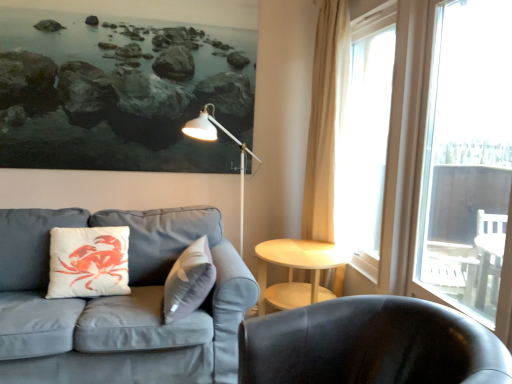
Describe the element at coordinates (88, 262) in the screenshot. The image size is (512, 384). I see `white matte pillow at left` at that location.

The height and width of the screenshot is (384, 512). Describe the element at coordinates (215, 140) in the screenshot. I see `white metal table lamp at upper center` at that location.

The width and height of the screenshot is (512, 384). Describe the element at coordinates (450, 161) in the screenshot. I see `transparent glass window at right, the second window in the back-to-front sequence` at that location.

Image resolution: width=512 pixels, height=384 pixels. Find the location of `transparent glass window at right, the second window in the back-to-front sequence`. transparent glass window at right, the second window in the back-to-front sequence is located at coordinates (450, 161).

Measure the distance between shiny black chair at lower right and camera.

The depth of shiny black chair at lower right is 1.15 meters.

What do you see at coordinates (298, 268) in the screenshot? I see `light wood/woodenobject at center` at bounding box center [298, 268].

At what (x,y) coordinates should I click in order to perform the action: click on white matte pillow at left. Please return your answer as a coordinate pair (x, y). The width and height of the screenshot is (512, 384). Looking at the image, I should click on (88, 262).

Is beige fabric curtain at right oriented towards white metal table lamp at upper center?

Yes, beige fabric curtain at right is aimed at white metal table lamp at upper center.

Between beige fabric curtain at right and white metal table lamp at upper center, which one has larger width?

white metal table lamp at upper center.

In order to click on table lamp that appears in front of the beige fabric curtain at right in this screenshot , I will do (x=215, y=140).

Can you confirm if gray fabric couch at left is bigger than transparent glass window at right, the first window positioned from the front?

Yes.

Considering the positions of point (2, 329) and point (451, 151), is point (2, 329) closer or farther from the camera than point (451, 151)?

Point (2, 329).

Which is correct: gray fabric couch at left is inside transparent glass window at right, the first window positioned from the front, or outside of it?

gray fabric couch at left exists outside the volume of transparent glass window at right, the first window positioned from the front.

Considering the sizes of transparent glass window at right, the second window in the back-to-front sequence, and white metal table lamp at upper center in the image, is transparent glass window at right, the second window in the back-to-front sequence, taller or shorter than white metal table lamp at upper center?

In the image, transparent glass window at right, the second window in the back-to-front sequence, appears to be taller than white metal table lamp at upper center.

Could white metal table lamp at upper center be considered to be inside transparent glass window at right, the second window in the back-to-front sequence?

No.

Can you tell me how much transparent glass window at right, the first window positioned from the front, and white metal table lamp at upper center differ in facing direction?

The angle between the facing direction of transparent glass window at right, the first window positioned from the front, and the facing direction of white metal table lamp at upper center is 43.1 degrees.

Which of these two, transparent glass window at right, the second window in the back-to-front sequence, or white metal table lamp at upper center, is wider?

With larger width is white metal table lamp at upper center.

This screenshot has width=512, height=384. Find the location of `table lamp on the left of shiny black chair at lower right`. table lamp on the left of shiny black chair at lower right is located at coordinates (215, 140).

Is shiny black chair at lower right not within white metal table lamp at upper center?

shiny black chair at lower right lies outside white metal table lamp at upper center's area.

From the image's perspective, which one is positioned higher, shiny black chair at lower right or white metal table lamp at upper center?

white metal table lamp at upper center.

Based on the photo, considering the relative positions of shiny black chair at lower right and white metal table lamp at upper center in the image provided, is shiny black chair at lower right to the left of white metal table lamp at upper center from the viewer's perspective?

In fact, shiny black chair at lower right is to the right of white metal table lamp at upper center.

Is white metal table lamp at upper center at the back of translucent glass window at right, positioned as the first window in back-to-front order?

translucent glass window at right, positioned as the first window in back-to-front order, does not have its back to white metal table lamp at upper center.

Is translucent glass window at right, positioned as the first window in back-to-front order, shorter than white metal table lamp at upper center?

No, translucent glass window at right, positioned as the first window in back-to-front order, is not shorter than white metal table lamp at upper center.

Locate an element on the screen. This screenshot has width=512, height=384. the 1st window in front when counting from the white metal table lamp at upper center is located at coordinates (367, 145).

From a real-world perspective, which is physically below, white matte pillow at left or beige fabric curtain at right?

white matte pillow at left.

Which is closer, (114, 257) or (337, 112)?

Point (114, 257) appears to be closer to the viewer than point (337, 112).

Does light wood/woodenobject at center turn towards white metal table lamp at upper center?

No, light wood/woodenobject at center is not oriented towards white metal table lamp at upper center.

Does light wood/woodenobject at center come behind white metal table lamp at upper center?

No, light wood/woodenobject at center is closer to the camera.

Which object is wider, light wood/woodenobject at center or white metal table lamp at upper center?

Wider between the two is white metal table lamp at upper center.

The image size is (512, 384). Find the location of `curtain on the right of the white metal table lamp at upper center`. curtain on the right of the white metal table lamp at upper center is located at coordinates (x=327, y=125).

In order to click on window lying in front of the gray fabric couch at left in this screenshot , I will do (450, 161).

When comparing their distances from beige fabric curtain at right, does translucent glass window at right, positioned as the first window in back-to-front order, or light wood/woodenobject at center seem further?

Among the two, light wood/woodenobject at center is located further to beige fabric curtain at right.

When comparing their distances from transparent glass window at right, the second window in the back-to-front sequence, does translucent glass window at right, which is the 2th window from front to back, or shiny black chair at lower right seem further?

The object further to transparent glass window at right, the second window in the back-to-front sequence, is shiny black chair at lower right.

Based on their spatial positions, is beige fabric curtain at right or shiny black chair at lower right further from white metal table lamp at upper center?

shiny black chair at lower right is further to white metal table lamp at upper center.

Estimate the real-world distances between objects in this image. Which object is closer to gray fabric couch at left, shiny black chair at lower right or translucent glass window at right, which is the 2th window from front to back?

shiny black chair at lower right is closer to gray fabric couch at left.

Based on their spatial positions, is gray fabric couch at left or white matte pillow at left closer to translucent glass window at right, which is the 2th window from front to back?

gray fabric couch at left is positioned closer to the anchor translucent glass window at right, which is the 2th window from front to back.

From the image, which object appears to be farther from shiny black chair at lower right, transparent glass window at right, the first window positioned from the front, or gray fabric couch at left?

transparent glass window at right, the first window positioned from the front, is positioned further to the anchor shiny black chair at lower right.

Estimate the real-world distances between objects in this image. Which object is further from beige fabric curtain at right, light wood/woodenobject at center or gray fabric couch at left?

Based on the image, gray fabric couch at left appears to be further to beige fabric curtain at right.

From the image, which object appears to be nearer to white metal table lamp at upper center, transparent glass window at right, the second window in the back-to-front sequence, or light wood/woodenobject at center?

light wood/woodenobject at center.

The image size is (512, 384). In order to click on table lamp between transparent glass window at right, the second window in the back-to-front sequence, and beige fabric curtain at right, along the z-axis in this screenshot , I will do `click(215, 140)`.

Where is `table lamp situated between gray fabric couch at left and translucent glass window at right, which is the 2th window from front to back, from left to right`? table lamp situated between gray fabric couch at left and translucent glass window at right, which is the 2th window from front to back, from left to right is located at coordinates (215, 140).

Locate an element on the screen. studio couch situated between white matte pillow at left and shiny black chair at lower right from left to right is located at coordinates (119, 304).

I want to click on table lamp between shiny black chair at lower right and beige fabric curtain at right along the z-axis, so click(215, 140).